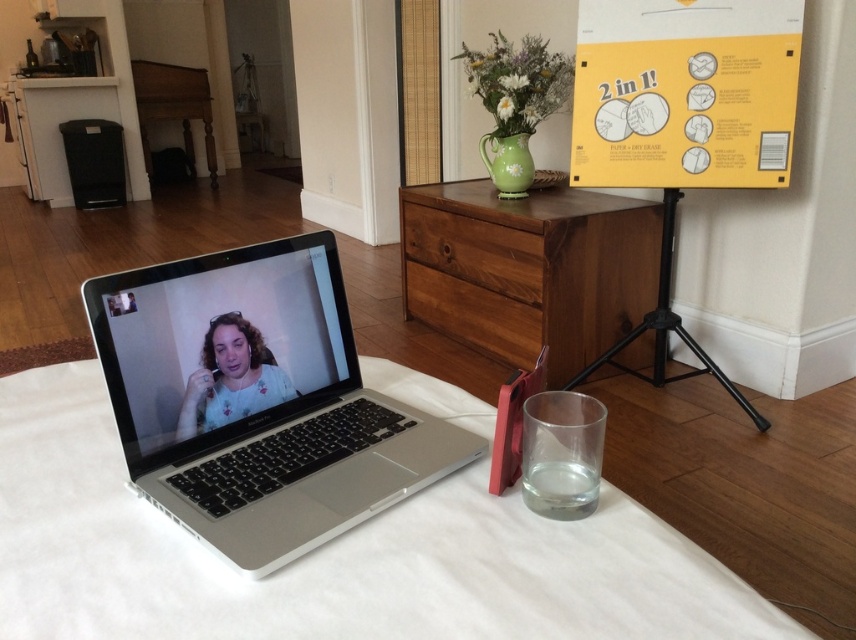
Looking at this image, you are standing in the room and want to reach both points. Which point, point (210, 397) or point (541, 333), will you reach first?

Point (210, 397) is closer to the viewer than point (541, 333), so you will reach point (210, 397) first.

You are setting up a new monitor that requires 3 inches of clearance behind it. You have the matte black laptop at center and the wooden drawer at center in your view. Which object do you need to move to ensure the monitor has enough space?

The wooden drawer at center needs to be moved because the matte black laptop at center is thinner than the wooden drawer at center, meaning the drawer takes up more space behind it.

You are a delivery robot with a package that needs to be placed between the white fabric table at center and the black metal tripod at lower right. The package requires a minimum of 5 feet of space to avoid tipping over. Based on the scene, will the available space between these two objects be sufficient?

The distance between the white fabric table at center and the black metal tripod at lower right is 4.78 feet, which is less than the required 5 feet. Therefore, the space is insufficient to safely place the package without risking it to tip over.